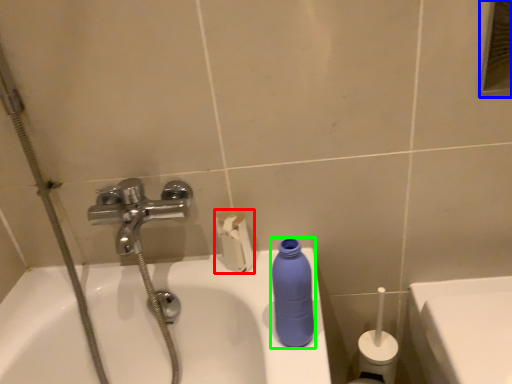
Question: Which object is positioned closest to toilet paper (highlighted by a red box)? Select from mirror (highlighted by a blue box) and cleaning product (highlighted by a green box).

Choices:
 (A) mirror
 (B) cleaning product

Answer: (B)